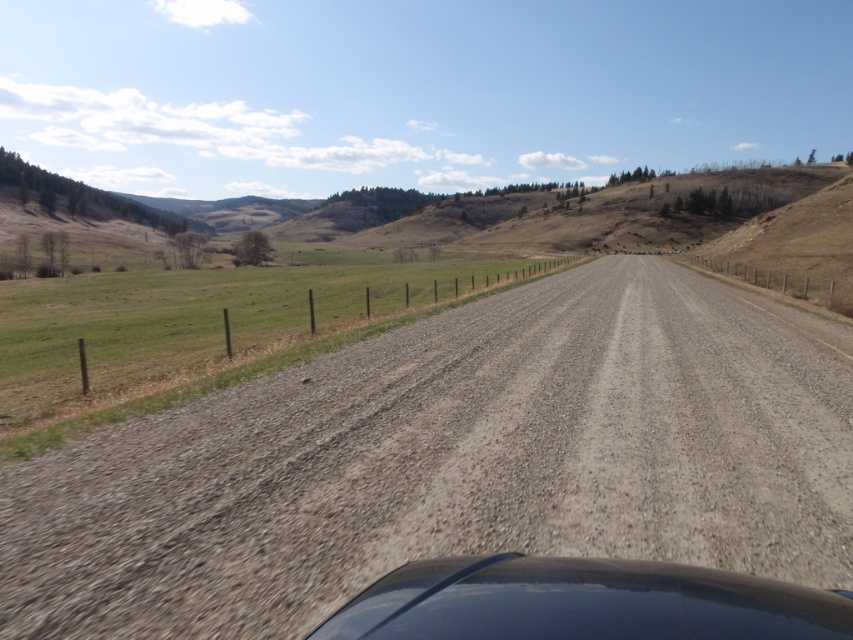
You are driving a car and want to know if your car is on the road. Based on the scene description, is the glossy black car at center positioned on the gray gravel road at center?

The gray gravel road at center is above the glossy black car at center, so the glossy black car at center is positioned on the gray gravel road at center.

You are driving a car and want to stay on the gray gravel road at center. However, you notice the glossy black car at center is in your way. Which direction should you steer to avoid it while staying on the road?

Since the gray gravel road at center is to the right of the glossy black car at center, you should steer to the right to stay on the road and avoid the car.

You are driving a truck that is 2.8 meters wide. You need to cross the gray gravel road at center. Can your truck safely pass through the road without hitting the fence on the left or the opposite side?

The gray gravel road at center is 3.13 meters wide, which is wider than the truck, so the truck can safely pass through the road without hitting the fence on the left or the opposite side.